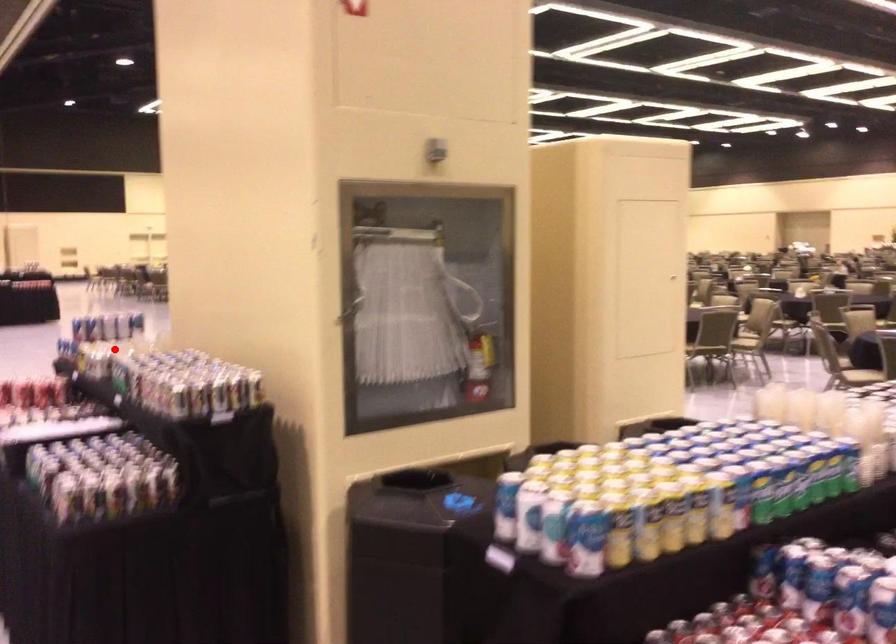
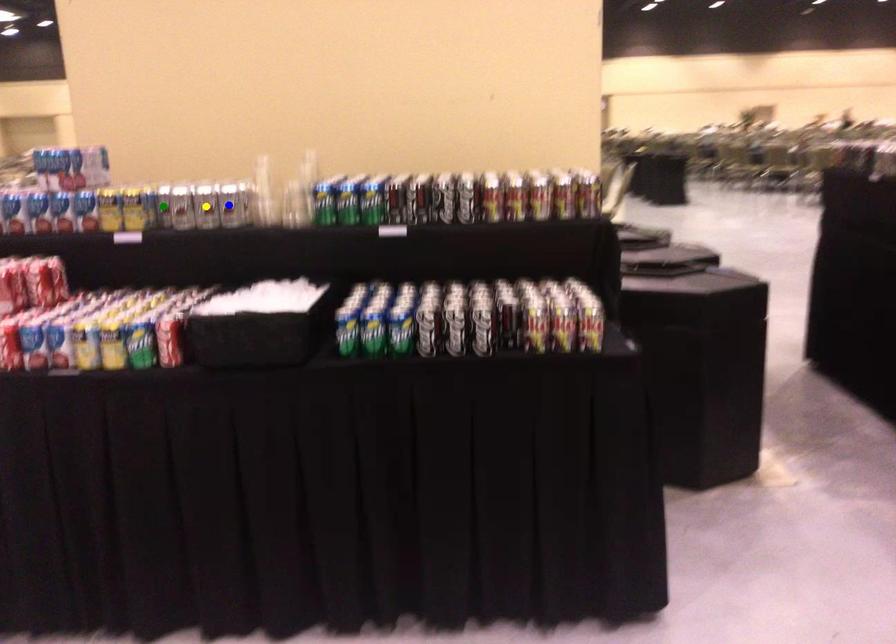
Question: I am providing you with two images of the same scene from different viewpoints. A red point is marked on the first image. You are given multiple points on the second image. Which spot in image 2 lines up with the point in image 1?

Choices:
 (A) green point
 (B) blue point
 (C) yellow point

Answer: (B)